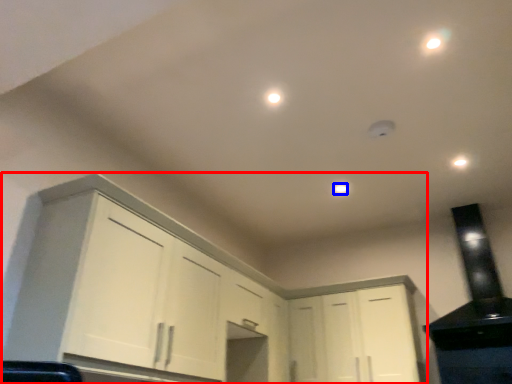
Question: Which of the following is the farthest to the observer, cabinetry (highlighted by a red box) or dot (highlighted by a blue box)?

Choices:
 (A) cabinetry
 (B) dot

Answer: (B)